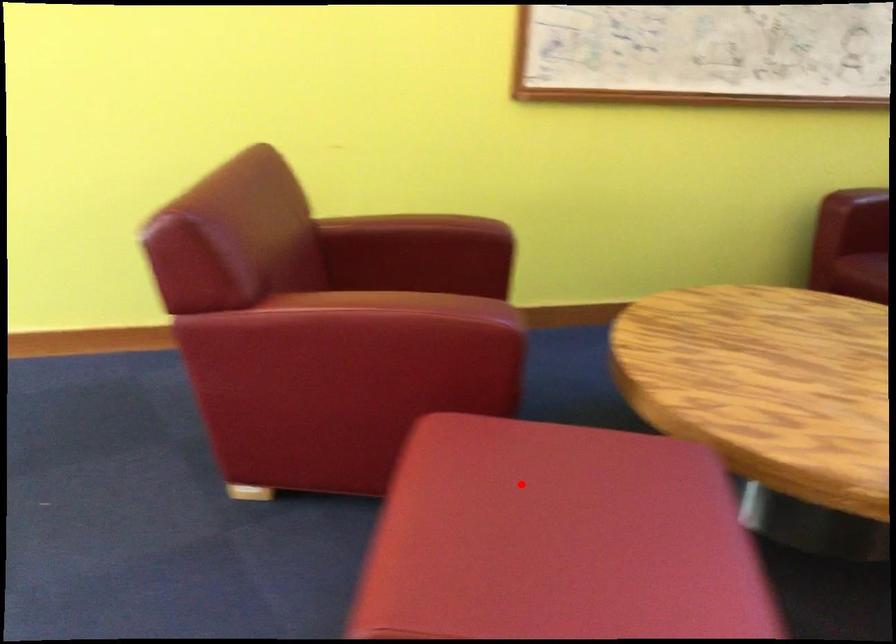
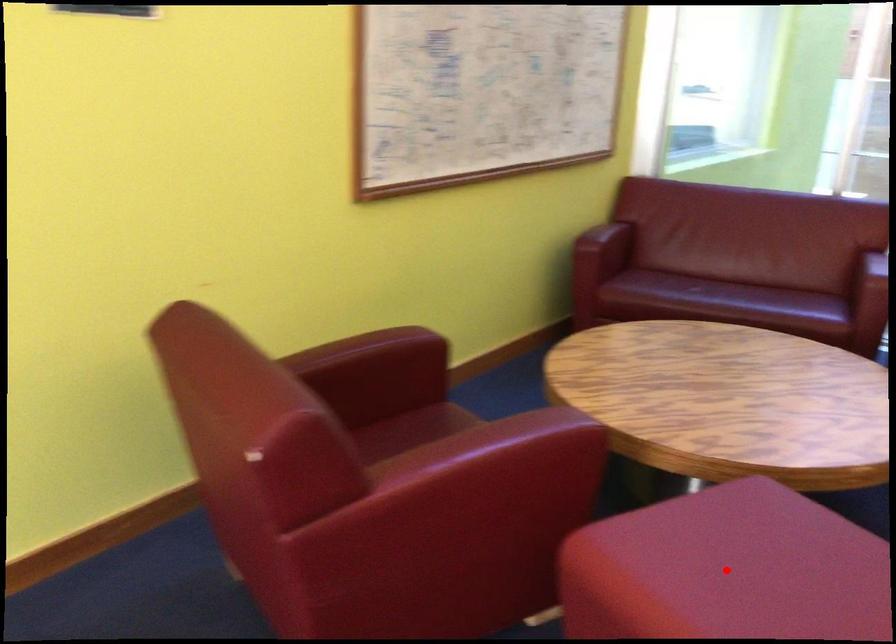
I am providing you with two images of the same scene from different viewpoints. A red point is marked on the first image and another point is marked on the second image. Is the marked point in image1 the same physical position as the marked point in image2?

Yes